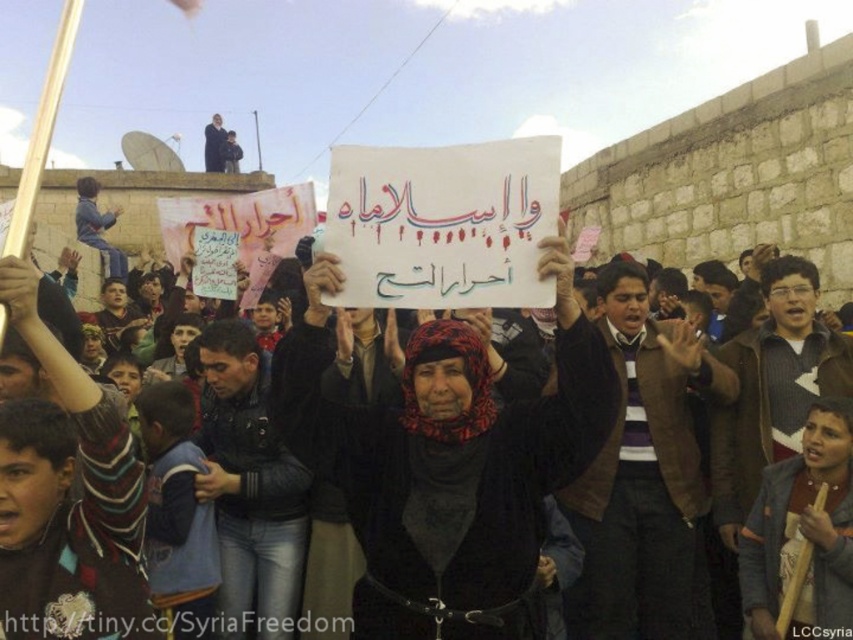
You are a photographer trying to frame a shot of the protest scene. The center of your camera viewfinder is at coordinate point 0.5, 0.5. Where should you adjust your camera to capture the black fabric headscarf at center?

The black fabric headscarf at center is located at coordinate point (445, 461), so you should adjust your camera to that coordinate point to capture it.

You are a photographer standing in front of the scene. You want to take a photo that includes both the black fabric headscarf at center and the white paper sign at center. Can you frame them in a single shot without zooming in? Explain your reasoning based on their distance apart.

The black fabric headscarf at center and white paper sign at center are 98.63 centimeters apart. Since they are less than a meter apart, they can likely be captured in a single photo without zooming in, as most standard camera lenses can accommodate objects within this distance in one frame.